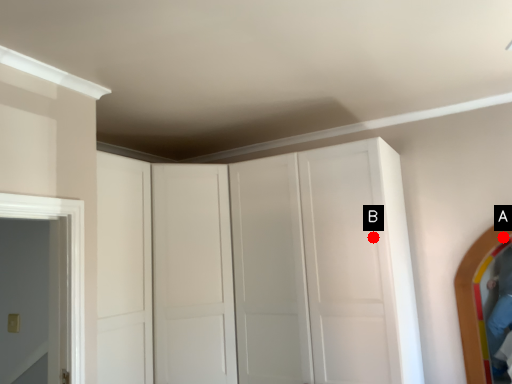
Question: Two points are circled on the image, labeled by A and B beside each circle. Which point is further to the camera?

Choices:
 (A) A is further
 (B) B is further

Answer: (A)